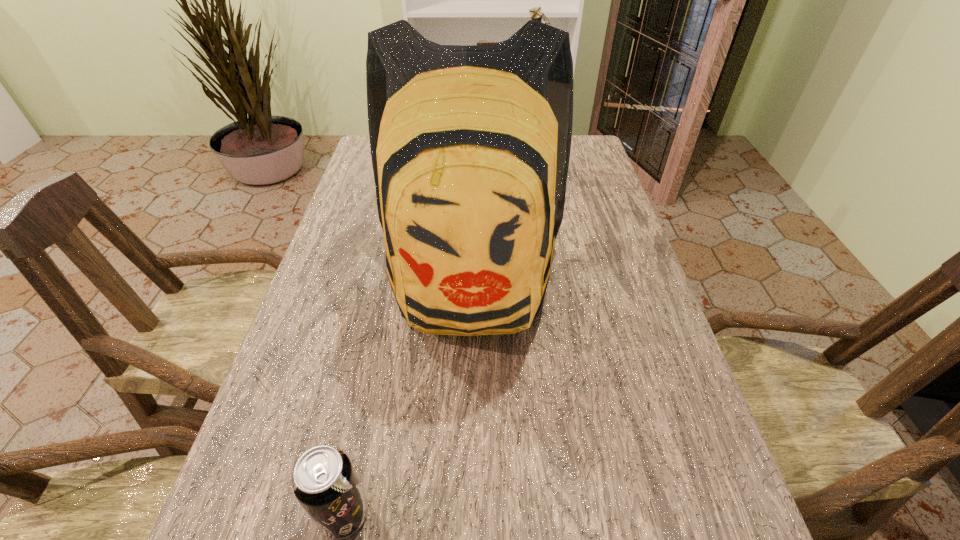
Find the location of a particular element. The width and height of the screenshot is (960, 540). backpack is located at coordinates (470, 144).

Locate an element on the screen. the farthest object is located at coordinates (536, 13).

Identify the location of vacant space located on the front-facing side of the second nearest object. (467, 470).

This screenshot has width=960, height=540. Identify the location of vacant space situated on the front-facing side of the sculpture. (467, 170).

In order to click on free region located 0.370m on the front-facing side of the sculpture in this screenshot , I will do 387,170.

This screenshot has width=960, height=540. Find the location of `free space located 0.180m on the front-facing side of the sculpture`. free space located 0.180m on the front-facing side of the sculpture is located at coordinates (450, 170).

The image size is (960, 540). I want to click on object at the far edge, so click(x=536, y=13).

You are a GUI agent. You are given a task and a screenshot of the screen. Output one action in this format:
    pyautogui.click(x=<x>, y=<y>)
    Task: Click on the object at the left edge
    
    Given the screenshot: What is the action you would take?
    pyautogui.click(x=470, y=144)

You are a GUI agent. You are given a task and a screenshot of the screen. Output one action in this format:
    pyautogui.click(x=<x>, y=<y>)
    Task: Click on the object that is at the right edge
    The height and width of the screenshot is (540, 960).
    Given the screenshot: What is the action you would take?
    pyautogui.click(x=536, y=13)

This screenshot has height=540, width=960. I want to click on object that is positioned at the far right corner, so click(x=536, y=13).